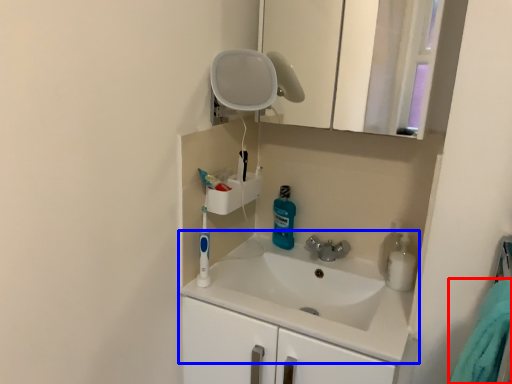
Question: Which object is closer to the camera taking this photo, bath towel (highlighted by a red box) or sink (highlighted by a blue box)?

Choices:
 (A) bath towel
 (B) sink

Answer: (A)